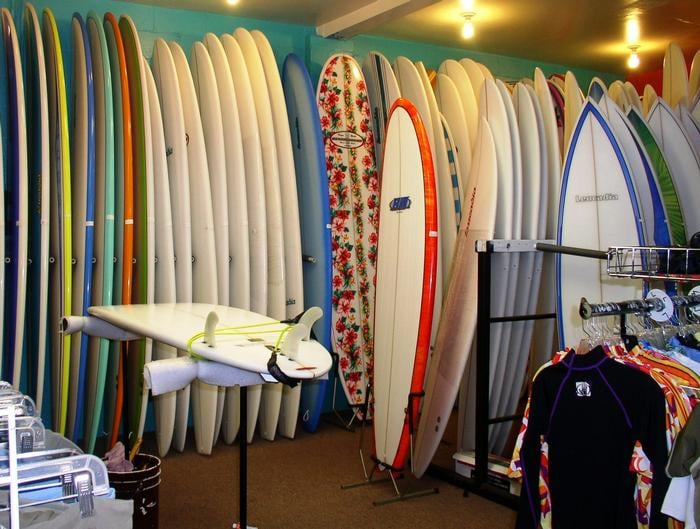
At what (x,y) coordinates should I click in order to perform the action: click on light. Please return your answer as a coordinate pair (x, y). Looking at the image, I should click on (460, 23), (636, 41).